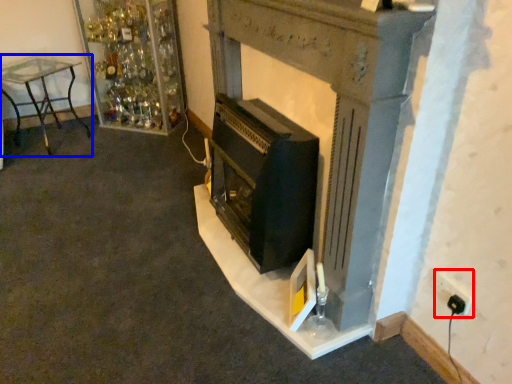
Question: Among these objects, which one is nearest to the camera, electric outlet (highlighted by a red box) or furniture (highlighted by a blue box)?

Choices:
 (A) electric outlet
 (B) furniture

Answer: (A)